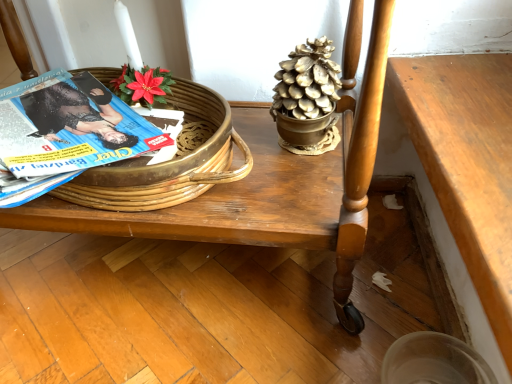
Question: Is wooden table at center in front of or behind woven wood basket at upper left in the image?

Choices:
 (A) front
 (B) behind

Answer: (A)

Question: In terms of size, does wooden table at center appear bigger or smaller than woven wood basket at upper left?

Choices:
 (A) big
 (B) small

Answer: (A)

Question: Considering the real-world distances, which object is farthest from the woven wood basket at upper left?

Choices:
 (A) blue glossy magazine at left
 (B) wooden table at center
 (C) wooden table at lower right
 (D) gold metallic pinecone at upper center

Answer: (C)

Question: Considering the real-world distances, which object is closest to the gold metallic pinecone at upper center?

Choices:
 (A) woven wood basket at upper left
 (B) blue glossy magazine at left
 (C) wooden table at center
 (D) wooden table at lower right

Answer: (C)